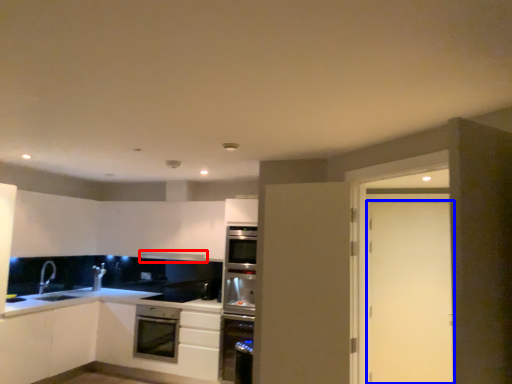
Question: Among these objects, which one is nearest to the camera, exhaust hood (highlighted by a red box) or door (highlighted by a blue box)?

Choices:
 (A) exhaust hood
 (B) door

Answer: (B)